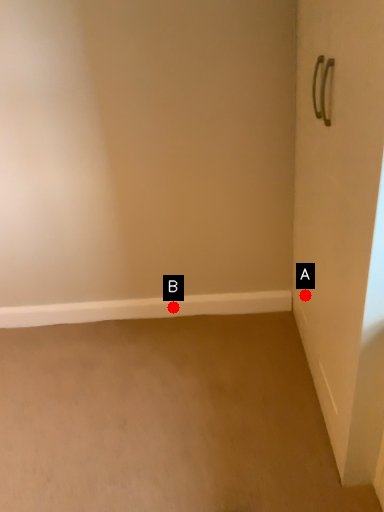
Question: Two points are circled on the image, labeled by A and B beside each circle. Which of the following is the closest to the observer?

Choices:
 (A) A is closer
 (B) B is closer

Answer: (A)